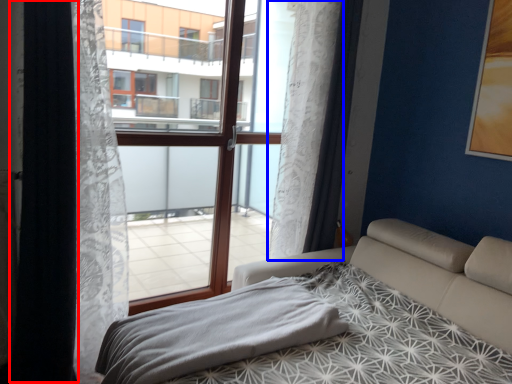
Question: Which of the following is the closest to the observer, curtain (highlighted by a red box) or curtain (highlighted by a blue box)?

Choices:
 (A) curtain
 (B) curtain

Answer: (A)